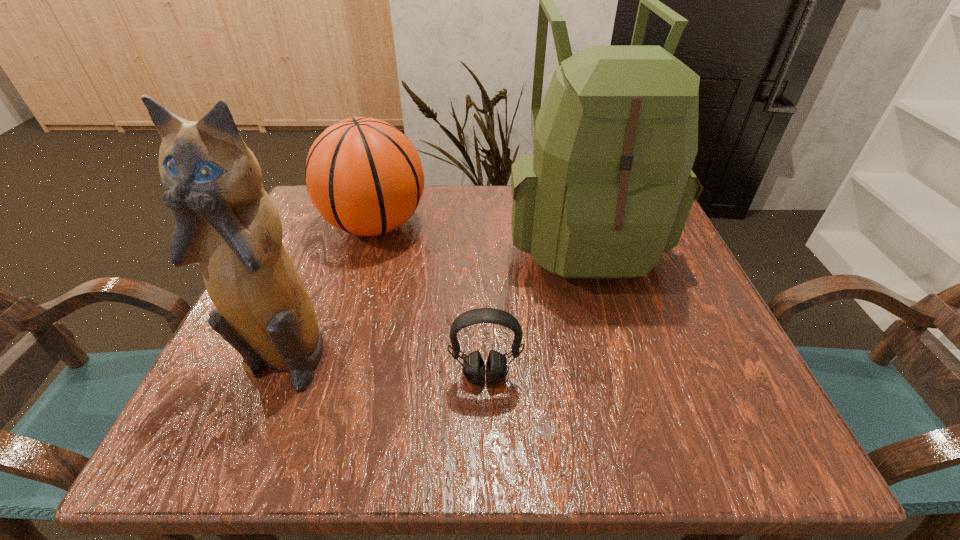
The height and width of the screenshot is (540, 960). Identify the location of unoccupied area between the basketball and the backpack. (478, 229).

This screenshot has height=540, width=960. In order to click on free space that is in between the third tallest object and the headset in this screenshot , I will do `click(430, 301)`.

At what (x,y) coordinates should I click in order to perform the action: click on vacant point located between the backpack and the basketball. Please return your answer as a coordinate pair (x, y). Looking at the image, I should click on (478, 229).

In order to click on vacant area that lies between the second shortest object and the backpack in this screenshot , I will do `click(478, 229)`.

Where is `free spot between the cat and the shortest object`? free spot between the cat and the shortest object is located at coordinates (385, 366).

Where is `vacant area between the basketball and the shortest object`? This screenshot has width=960, height=540. vacant area between the basketball and the shortest object is located at coordinates (430, 301).

Identify the location of empty location between the backpack and the second shortest object. This screenshot has width=960, height=540. (478, 229).

Where is `free space that is in between the backpack and the basketball`? free space that is in between the backpack and the basketball is located at coordinates (478, 229).

Locate an element on the screen. vacant area that lies between the shortest object and the backpack is located at coordinates (534, 305).

The height and width of the screenshot is (540, 960). What are the coordinates of `free spot between the backpack and the second shortest object` in the screenshot? It's located at (478, 229).